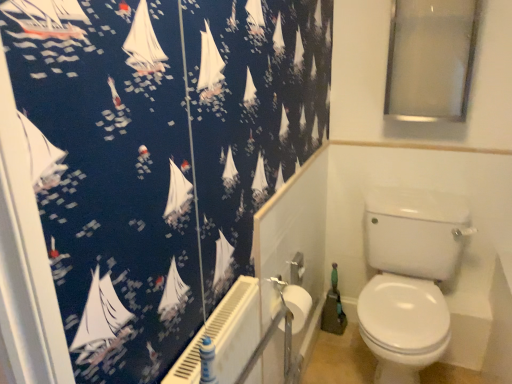
This screenshot has height=384, width=512. I want to click on vacant region below transparent glass window screen at upper right (from a real-world perspective), so click(x=411, y=208).